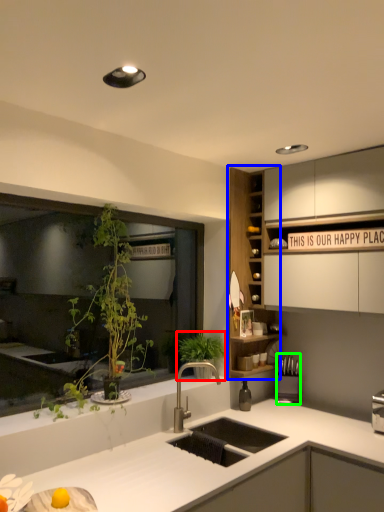
Question: Which object is positioned farthest from vegetation (highlighted by a red box)? Select from cabinet (highlighted by a blue box) and appliance (highlighted by a green box).

Choices:
 (A) cabinet
 (B) appliance

Answer: (B)